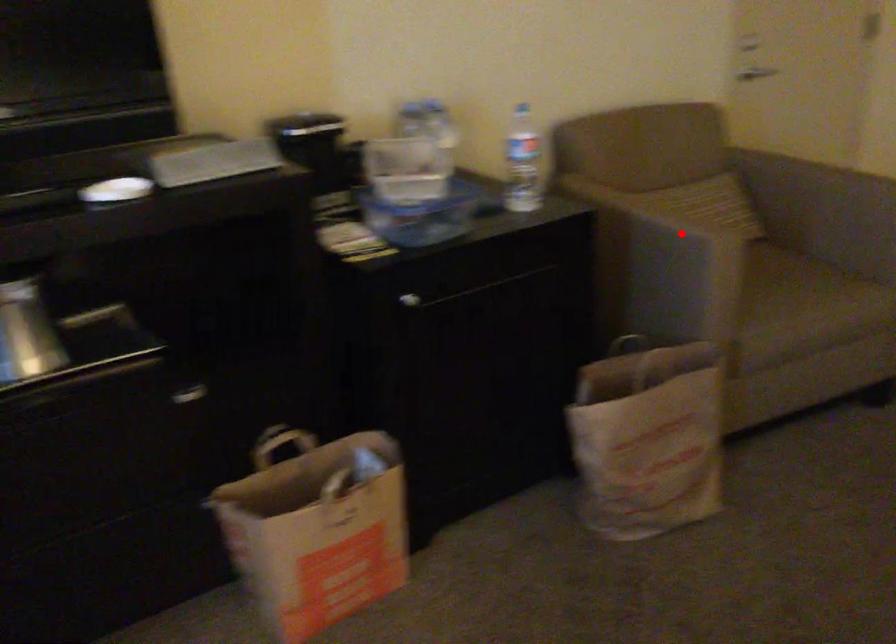
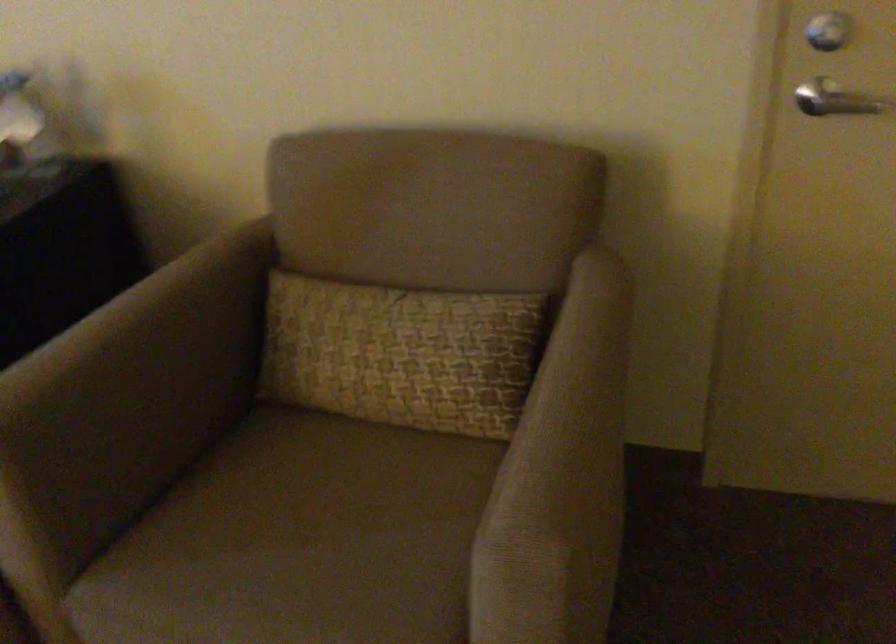
Find the pixel in the second image that matches the highlighted location in the first image.

(135, 389)